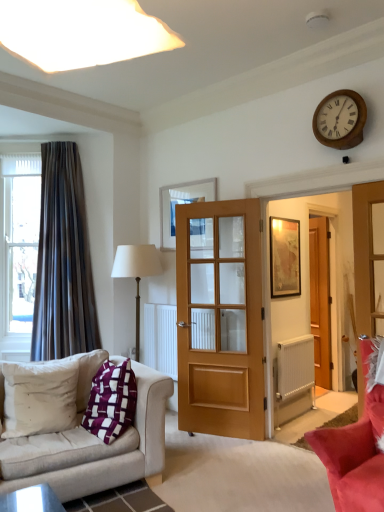
Where is `silver metallic picture frame at center, arranged as the 1th picture frame when viewed from the left`? silver metallic picture frame at center, arranged as the 1th picture frame when viewed from the left is located at coordinates (181, 203).

What do you see at coordinates (181, 203) in the screenshot? I see `silver metallic picture frame at center, the second picture frame positioned from the right` at bounding box center [181, 203].

At what (x,y) coordinates should I click in order to perform the action: click on white soft cushion at lower left, the 1th pillow from the left. Please return your answer as a coordinate pair (x, y). Looking at the image, I should click on (39, 397).

The height and width of the screenshot is (512, 384). I want to click on wooden door at center, which is the second door from left to right, so click(x=320, y=298).

Locate an element on the screen. The height and width of the screenshot is (512, 384). matte gold picture frame at center-right, which is the 1th picture frame from right to left is located at coordinates [x=285, y=258].

Identify the location of silver metallic picture frame at center, arranged as the 1th picture frame when viewed from the left. [181, 203].

Looking at this image, are matte gold picture frame at center-right, the 2th picture frame from the left, and white soft cushion at lower left, the 1th pillow from the left, beside each other?

No, matte gold picture frame at center-right, the 2th picture frame from the left, is not with white soft cushion at lower left, the 1th pillow from the left.

Does point (300, 274) come in front of point (19, 385)?

No, (300, 274) is behind (19, 385).

From the picture: Is the position of matte gold picture frame at center-right, the 2th picture frame from the left, more distant than that of white soft cushion at lower left, arranged as the 2th pillow when viewed from the right?

Yes, it is behind white soft cushion at lower left, arranged as the 2th pillow when viewed from the right.

Is matte gold picture frame at center-right, which is the 1th picture frame from right to left, facing towards white soft cushion at lower left, the 1th pillow from the left?

No, matte gold picture frame at center-right, which is the 1th picture frame from right to left, is not facing towards white soft cushion at lower left, the 1th pillow from the left.

From the image's perspective, is matte gold picture frame at center-right, the 2th picture frame from the left, above beige fabric couch at lower left, the 1th studio couch positioned from the left?

Yes, from the image's perspective, matte gold picture frame at center-right, the 2th picture frame from the left, is over beige fabric couch at lower left, the 1th studio couch positioned from the left.

Is matte gold picture frame at center-right, the 2th picture frame from the left, positioned with its back to beige fabric couch at lower left, the 1th studio couch positioned from the left?

No, beige fabric couch at lower left, the 1th studio couch positioned from the left, is not at the back of matte gold picture frame at center-right, the 2th picture frame from the left.

Which is in front, point (293, 247) or point (163, 399)?

Positioned in front is point (163, 399).

Is matte gold picture frame at center-right, the 2th picture frame from the left, wider or thinner than beige fabric couch at lower left, the 2th studio couch viewed from the right?

Clearly, matte gold picture frame at center-right, the 2th picture frame from the left, has less width compared to beige fabric couch at lower left, the 2th studio couch viewed from the right.

Choose the correct answer: Is white soft cushion at lower left, arranged as the 2th pillow when viewed from the right, inside clear glass window at left or outside it?

white soft cushion at lower left, arranged as the 2th pillow when viewed from the right, is not enclosed by clear glass window at left.

From a real-world perspective, is white soft cushion at lower left, arranged as the 2th pillow when viewed from the right, positioned under clear glass window at left based on gravity?

Yes, from a real-world perspective, white soft cushion at lower left, arranged as the 2th pillow when viewed from the right, is below clear glass window at left.

Is white soft cushion at lower left, the 1th pillow from the left, touching clear glass window at left?

They are not placed beside each other.

Could you tell me if white soft cushion at lower left, arranged as the 2th pillow when viewed from the right, is turned towards clear glass window at left?

No, white soft cushion at lower left, arranged as the 2th pillow when viewed from the right, does not turn towards clear glass window at left.

What's the angular difference between beige fabric couch at lower left, the 2th studio couch viewed from the right, and silver metallic picture frame at center, arranged as the 1th picture frame when viewed from the left,'s facing directions?

The angle between the facing direction of beige fabric couch at lower left, the 2th studio couch viewed from the right, and the facing direction of silver metallic picture frame at center, arranged as the 1th picture frame when viewed from the left, is 76.3 degrees.

Is point (111, 462) closer or farther from the camera than point (160, 234)?

Point (111, 462) appears to be closer to the viewer than point (160, 234).

Which of these two, beige fabric couch at lower left, the 1th studio couch positioned from the left, or silver metallic picture frame at center, arranged as the 1th picture frame when viewed from the left, is smaller?

Smaller between the two is silver metallic picture frame at center, arranged as the 1th picture frame when viewed from the left.

Considering the relative sizes of beige fabric couch at lower left, the 1th studio couch positioned from the left, and silver metallic picture frame at center, the second picture frame positioned from the right, in the image provided, is beige fabric couch at lower left, the 1th studio couch positioned from the left, shorter than silver metallic picture frame at center, the second picture frame positioned from the right,?

No, beige fabric couch at lower left, the 1th studio couch positioned from the left, is not shorter than silver metallic picture frame at center, the second picture frame positioned from the right.

Which is correct: dark grey velvet curtain at left is inside silver metallic picture frame at center, arranged as the 1th picture frame when viewed from the left, or outside of it?

dark grey velvet curtain at left lies outside silver metallic picture frame at center, arranged as the 1th picture frame when viewed from the left.

Considering the sizes of objects dark grey velvet curtain at left and silver metallic picture frame at center, arranged as the 1th picture frame when viewed from the left, in the image provided, who is bigger, dark grey velvet curtain at left or silver metallic picture frame at center, arranged as the 1th picture frame when viewed from the left,?

dark grey velvet curtain at left.

Is dark grey velvet curtain at left looking in the opposite direction of silver metallic picture frame at center, the second picture frame positioned from the right?

No.

Locate an element on the screen. The height and width of the screenshot is (512, 384). picture frame above the dark grey velvet curtain at left (from the image's perspective) is located at coordinates (181, 203).

Which object is further away from the camera taking this photo, silver metallic picture frame at center, arranged as the 1th picture frame when viewed from the left, or clear glass window at left?

clear glass window at left is further away from the camera.

Which of these two, silver metallic picture frame at center, arranged as the 1th picture frame when viewed from the left, or clear glass window at left, stands taller?

Standing taller between the two is clear glass window at left.

From a real-world perspective, is silver metallic picture frame at center, the second picture frame positioned from the right, physically above clear glass window at left?

Yes, from a real-world perspective, silver metallic picture frame at center, the second picture frame positioned from the right, is over clear glass window at left

Measure the distance from silver metallic picture frame at center, the second picture frame positioned from the right, to clear glass window at left.

The distance of silver metallic picture frame at center, the second picture frame positioned from the right, from clear glass window at left is 4.84 feet.

From the image's perspective, is wooden wall clock at upper right beneath silver metallic picture frame at center, arranged as the 1th picture frame when viewed from the left?

No.

Considering the relative sizes of wooden wall clock at upper right and silver metallic picture frame at center, arranged as the 1th picture frame when viewed from the left, in the image provided, is wooden wall clock at upper right wider than silver metallic picture frame at center, arranged as the 1th picture frame when viewed from the left,?

Indeed, wooden wall clock at upper right has a greater width compared to silver metallic picture frame at center, arranged as the 1th picture frame when viewed from the left.

Is wooden wall clock at upper right shorter than silver metallic picture frame at center, arranged as the 1th picture frame when viewed from the left?

Indeed, wooden wall clock at upper right has a lesser height compared to silver metallic picture frame at center, arranged as the 1th picture frame when viewed from the left.

From the image's perspective, which picture frame is the 1st one below the wooden wall clock at upper right? Please provide its 2D coordinates.

[(181, 203)]

Starting from the matte gold picture frame at center-right, which is the 1th picture frame from right to left, which pillow is the 1st one in front? Please provide its 2D coordinates.

[(39, 397)]

Identify the location of picture frame that is the 2nd one when counting rightward from the beige fabric couch at lower left, the 1th studio couch positioned from the left. This screenshot has width=384, height=512. (285, 258).

Based on their spatial positions, is wooden wall clock at upper right or silver metallic picture frame at center, the second picture frame positioned from the right, further from velvet red sofa at lower right, the 1th studio couch viewed from the right?

silver metallic picture frame at center, the second picture frame positioned from the right, is further to velvet red sofa at lower right, the 1th studio couch viewed from the right.

When comparing their distances from wooden door at center, which is the second door from left to right, does beige fabric couch at lower left, the 2th studio couch viewed from the right, or dark grey velvet curtain at left seem further?

beige fabric couch at lower left, the 2th studio couch viewed from the right.

Which object lies nearer to the anchor point clear glass window at left, velvet red sofa at lower right, the 1th studio couch viewed from the right, or white textured radiator at lower right?

white textured radiator at lower right is positioned closer to the anchor clear glass window at left.

Considering their positions, is matte gold picture frame at center-right, the 2th picture frame from the left, positioned closer to wooden door at center, the 1th door positioned from the right, than velvet red sofa at lower right, the 1th studio couch viewed from the right?

The object closer to wooden door at center, the 1th door positioned from the right, is matte gold picture frame at center-right, the 2th picture frame from the left.

Based on their spatial positions, is matte gold picture frame at center-right, which is the 1th picture frame from right to left, or purple fabric pillow at lower left, the 2th pillow viewed from the left, further from velvet red sofa at lower right, acting as the second studio couch starting from the left?

matte gold picture frame at center-right, which is the 1th picture frame from right to left, lies further to velvet red sofa at lower right, acting as the second studio couch starting from the left, than the other object.

Based on the photo, considering their positions, is white textured radiator at lower right positioned further to dark grey velvet curtain at left than white soft cushion at lower left, arranged as the 2th pillow when viewed from the right?

white textured radiator at lower right is further to dark grey velvet curtain at left.

Considering their positions, is matte gold picture frame at center-right, the 2th picture frame from the left, positioned closer to light brown wooden door at center, the second door viewed from the right, than wooden door at center, the 1th door positioned from the right?

Among the two, matte gold picture frame at center-right, the 2th picture frame from the left, is located nearer to light brown wooden door at center, the second door viewed from the right.

Considering their positions, is white soft cushion at lower left, the 1th pillow from the left, positioned closer to beige fabric couch at lower left, the 2th studio couch viewed from the right, than dark grey velvet curtain at left?

white soft cushion at lower left, the 1th pillow from the left, is positioned closer to the anchor beige fabric couch at lower left, the 2th studio couch viewed from the right.

Locate an element on the screen. curtain between velvet red sofa at lower right, acting as the second studio couch starting from the left, and wooden door at center, the 1th door positioned from the right, along the z-axis is located at coordinates (63, 261).

The width and height of the screenshot is (384, 512). What are the coordinates of `door situated between beige fabric couch at lower left, the 1th studio couch positioned from the left, and white textured radiator at lower right from left to right` in the screenshot? It's located at (220, 319).

You are a GUI agent. You are given a task and a screenshot of the screen. Output one action in this format:
    pyautogui.click(x=<x>, y=<y>)
    Task: Click on the curtain located between clear glass window at left and wooden wall clock at upper right in the left-right direction
    The image size is (384, 512).
    Given the screenshot: What is the action you would take?
    pyautogui.click(x=63, y=261)

In order to click on picture frame between purple fabric pillow at lower left, positioned as the 1th pillow in right-to-left order, and matte gold picture frame at center-right, the 2th picture frame from the left in this screenshot , I will do `click(181, 203)`.